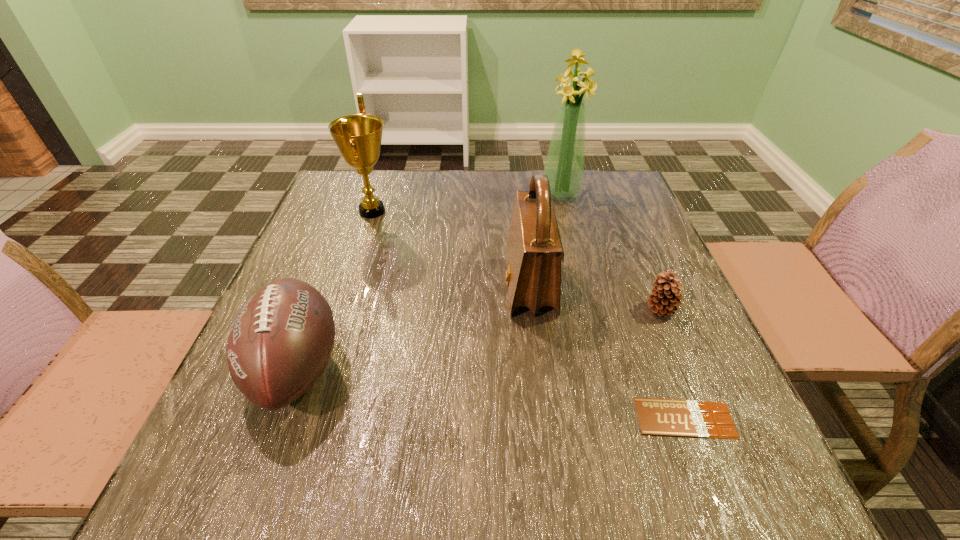
This screenshot has width=960, height=540. In order to click on bouquet in this screenshot , I will do `click(564, 166)`.

Identify the location of award. pyautogui.click(x=358, y=137).

What are the coordinates of `the third object from left to right` in the screenshot? It's located at (534, 252).

Where is `the fourth tallest object`? the fourth tallest object is located at coordinates (280, 342).

Identify the location of the fifth tallest object. Image resolution: width=960 pixels, height=540 pixels. [x=666, y=296].

The width and height of the screenshot is (960, 540). What are the coordinates of `chocolate bar` in the screenshot? It's located at (662, 417).

Image resolution: width=960 pixels, height=540 pixels. I want to click on blank area located on the front-facing side of the tallest object, so tap(589, 307).

You are a GUI agent. You are given a task and a screenshot of the screen. Output one action in this format:
    pyautogui.click(x=<x>, y=<y>)
    Task: Click on the vacant space located on the front view with handles of the award
    Image resolution: width=960 pixels, height=540 pixels.
    Given the screenshot: What is the action you would take?
    pyautogui.click(x=445, y=211)

The image size is (960, 540). In order to click on vacant space located 0.170m on the front flap of the third object from left to right in this screenshot , I will do pyautogui.click(x=426, y=286).

Image resolution: width=960 pixels, height=540 pixels. In order to click on free space located on the front flap of the third object from left to right in this screenshot , I will do `click(333, 286)`.